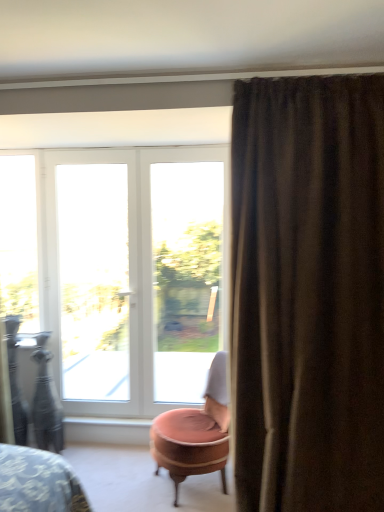
Question: From a real-world perspective, is clear glass window at left, the first window viewed from the left, physically located above or below white plastic window at center, which is the first window from right to left?

Choices:
 (A) below
 (B) above

Answer: (B)

Question: In terms of size, does clear glass window at left, the 3th window in the right-to-left sequence, appear bigger or smaller than white plastic window at center, marked as the third window in a left-to-right arrangement?

Choices:
 (A) small
 (B) big

Answer: (A)

Question: Which of these objects is positioned farthest from the brown textured curtain at right?

Choices:
 (A) pink velvet ottoman at center
 (B) white glass door at left, which appears as the 2th window when viewed from the left
 (C) clear glass window at left, the 3th window in the right-to-left sequence
 (D) white glass door at center
 (E) white glossy window sill at lower center

Answer: (C)

Question: Considering the real-world distances, which object is farthest from the clear glass window at left, the first window viewed from the left?

Choices:
 (A) white glass door at left, placed as the 2th window when sorted from right to left
 (B) white plastic window at center, which is the first window from right to left
 (C) white glossy window sill at lower center
 (D) white glass door at center
 (E) brown textured curtain at right

Answer: (E)